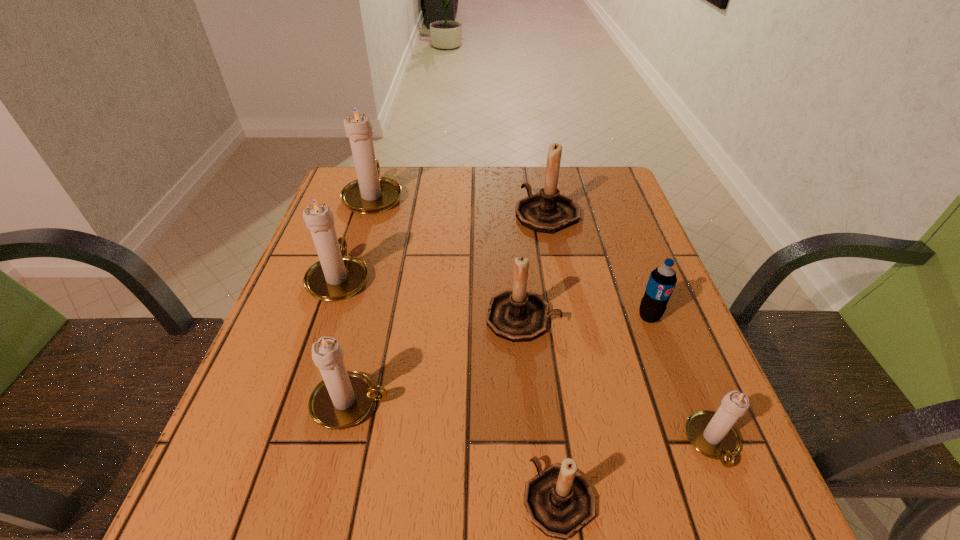
I want to click on the biggest white candle holder, so click(370, 194).

Find the location of `the tallest object`. the tallest object is located at coordinates (370, 194).

I want to click on the biggest brown candle holder, so (548, 211).

Identify the location of the third nearest white candle holder. (336, 276).

The width and height of the screenshot is (960, 540). I want to click on the second nearest brown candle holder, so click(517, 315).

The height and width of the screenshot is (540, 960). In order to click on the third biggest white candle holder in this screenshot , I will do coord(343,398).

The height and width of the screenshot is (540, 960). I want to click on soda bottle, so [662, 280].

In order to click on the rightmost candle holder in this screenshot , I will do `click(714, 435)`.

Where is `the smallest white candle holder`? the smallest white candle holder is located at coordinates (714, 435).

At what (x,y) coordinates should I click in order to perform the action: click on free space located on the handle side of the biggest white candle holder. Please return your answer as a coordinate pair (x, y). The image size is (960, 540). Looking at the image, I should click on 383,167.